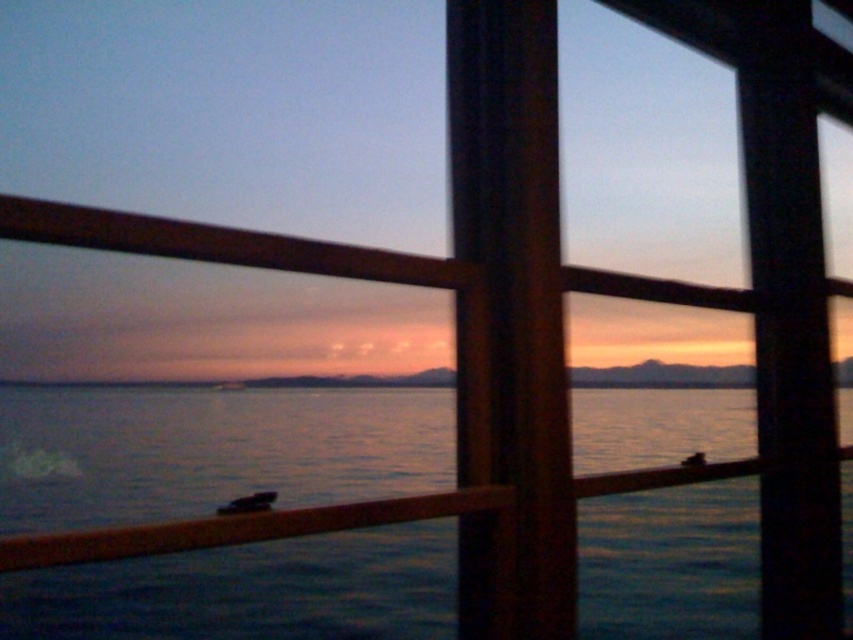
Question: Which point is closer to the camera taking this photo?

Choices:
 (A) (643, 368)
 (B) (103, 442)

Answer: (B)

Question: Is blue water at center to the left of smooth water at center from the viewer's perspective?

Choices:
 (A) yes
 (B) no

Answer: (B)

Question: Which point is farther to the camera?

Choices:
 (A) coord(422,544)
 (B) coord(749,368)

Answer: (B)

Question: Can you confirm if blue water at center is positioned to the left of smooth water at center?

Choices:
 (A) no
 (B) yes

Answer: (A)

Question: Can you confirm if blue water at center is positioned to the right of smooth water at center?

Choices:
 (A) no
 (B) yes

Answer: (B)